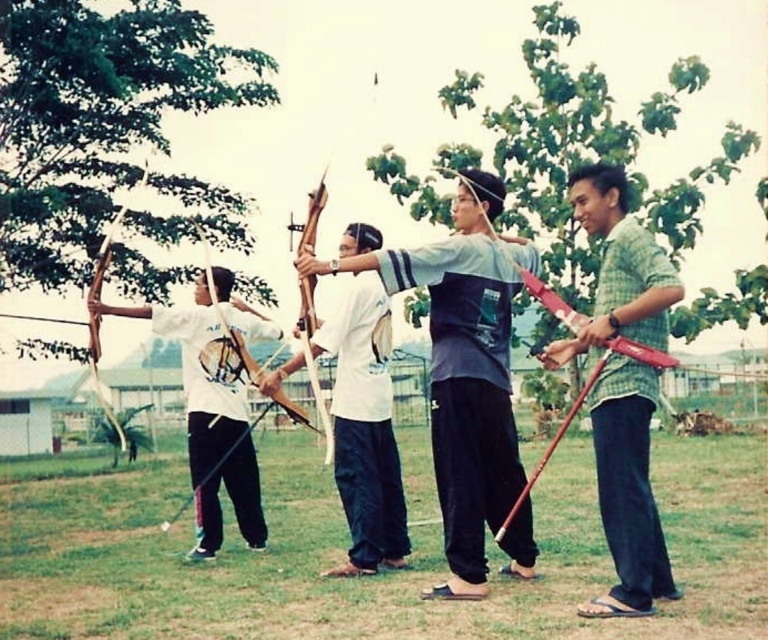
Question: Considering the real-world distances, which object is farthest from the wooden bow at left?

Choices:
 (A) white matte bow at center
 (B) green checkered shirt at right

Answer: (B)

Question: Considering the relative positions of matte gray shirt at center and matte wood bow at center in the image provided, where is matte gray shirt at center located with respect to matte wood bow at center?

Choices:
 (A) above
 (B) below

Answer: (B)

Question: Does green checkered shirt at right appear on the left side of wooden bow at left?

Choices:
 (A) yes
 (B) no

Answer: (B)

Question: Is matte gray shirt at center below white matte t-shirt at center?

Choices:
 (A) no
 (B) yes

Answer: (A)

Question: Which object is farther from the camera taking this photo?

Choices:
 (A) white matte bow at center
 (B) matte gray shirt at center

Answer: (A)

Question: Which of these objects is positioned closest to the wooden bow at left?

Choices:
 (A) green checkered shirt at right
 (B) white matte t-shirt at center

Answer: (A)